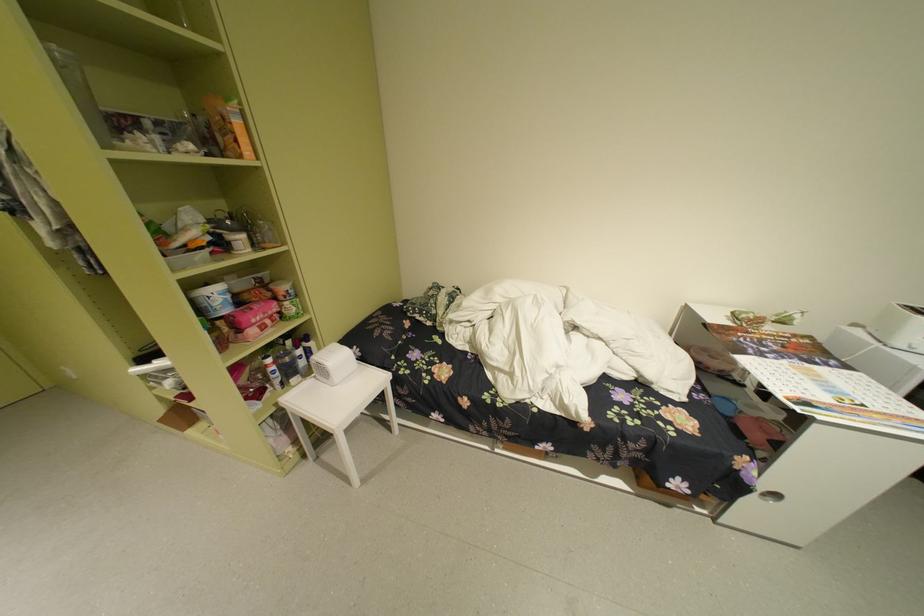
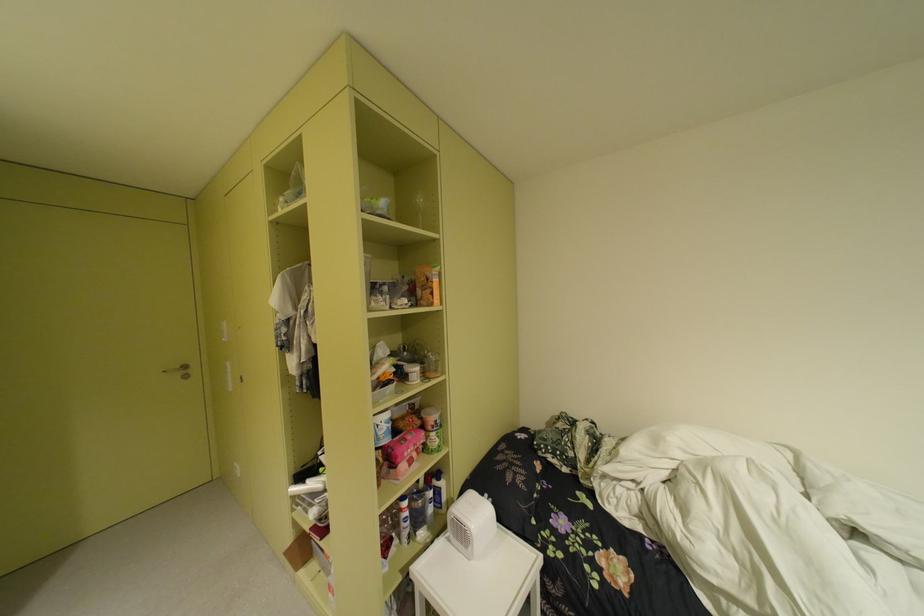
Question: Which direction would the cameraman need to move to produce the second image? Reply with the corresponding letter.

Choices:
 (A) Left
 (B) Right
 (C) Forward
 (D) Backward

Answer: (A)